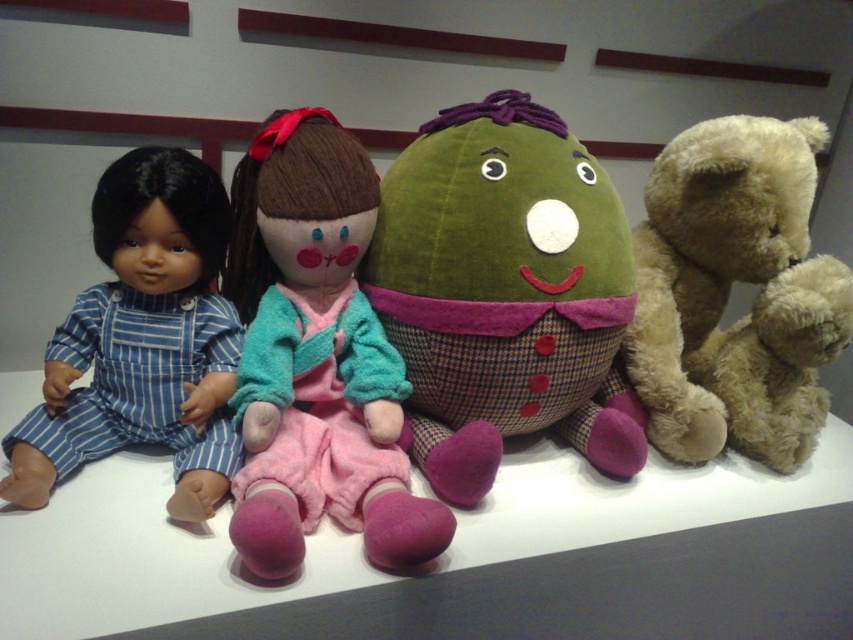
Question: Is green velvety plush at center closer to the viewer compared to velvety pink dress at center?

Choices:
 (A) no
 (B) yes

Answer: (A)

Question: Is light brown plush bear at right in front of matte blue striped overalls at left?

Choices:
 (A) yes
 (B) no

Answer: (B)

Question: Which point is closer to the camera taking this photo?

Choices:
 (A) (231, 298)
 (B) (743, 188)

Answer: (A)

Question: Is green velvety plush at center positioned in front of velvety pink dress at center?

Choices:
 (A) no
 (B) yes

Answer: (A)

Question: Among these points, which one is farthest from the camera?

Choices:
 (A) (540, 216)
 (B) (277, 202)

Answer: (A)

Question: Which point is farther to the camera?

Choices:
 (A) green velvety plush at center
 (B) matte blue striped overalls at left

Answer: (A)